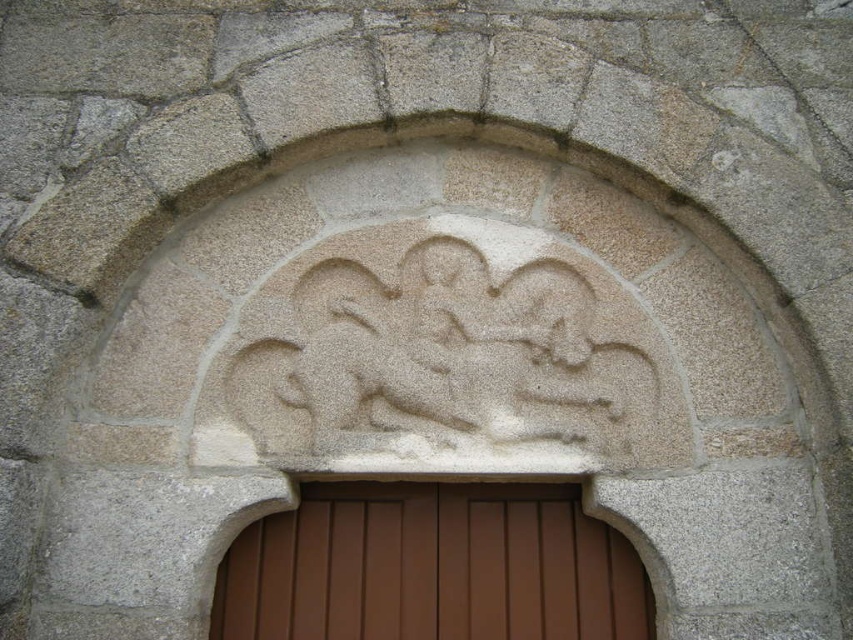
Question: Among these points, which one is nearest to the camera?

Choices:
 (A) (608, 336)
 (B) (384, 596)

Answer: (B)

Question: Which point is closer to the camera?

Choices:
 (A) (248, 394)
 (B) (532, 605)

Answer: (B)

Question: Where is white stone carving at center located in relation to brown wooden door at center in the image?

Choices:
 (A) above
 (B) below

Answer: (A)

Question: Does white stone carving at center have a smaller size compared to brown wooden door at center?

Choices:
 (A) yes
 (B) no

Answer: (B)

Question: Is white stone carving at center to the left of brown wooden door at center from the viewer's perspective?

Choices:
 (A) no
 (B) yes

Answer: (A)

Question: Which point is closer to the camera taking this photo?

Choices:
 (A) coord(335,580)
 (B) coord(635,369)

Answer: (A)